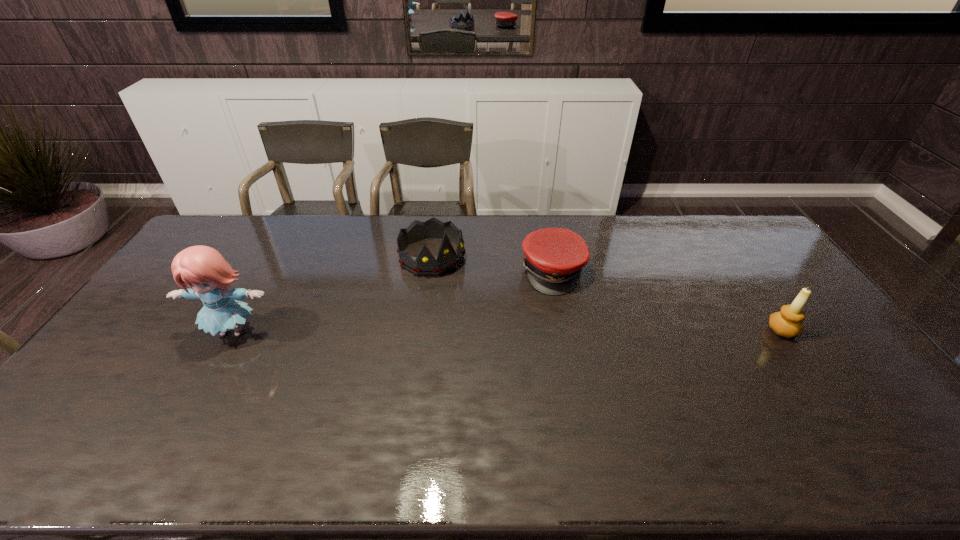
Identify the location of vacant region between the shortest object and the second object from left to right. Image resolution: width=960 pixels, height=540 pixels. (492, 264).

At what (x,y) coordinates should I click in order to perform the action: click on free point between the tiara and the cap. Please return your answer as a coordinate pair (x, y). This screenshot has height=540, width=960. Looking at the image, I should click on (492, 264).

Where is `vacant space that's between the leftmost object and the tiara`? vacant space that's between the leftmost object and the tiara is located at coordinates (332, 294).

Select which object appears as the third closest to the doll. Please provide its 2D coordinates. Your answer should be formatted as a tuple, i.e. [(x, y)], where the tuple contains the x and y coordinates of a point satisfying the conditions above.

[(787, 322)]

Locate an element on the screen. This screenshot has height=540, width=960. object that stands as the third closest to the cap is located at coordinates (202, 268).